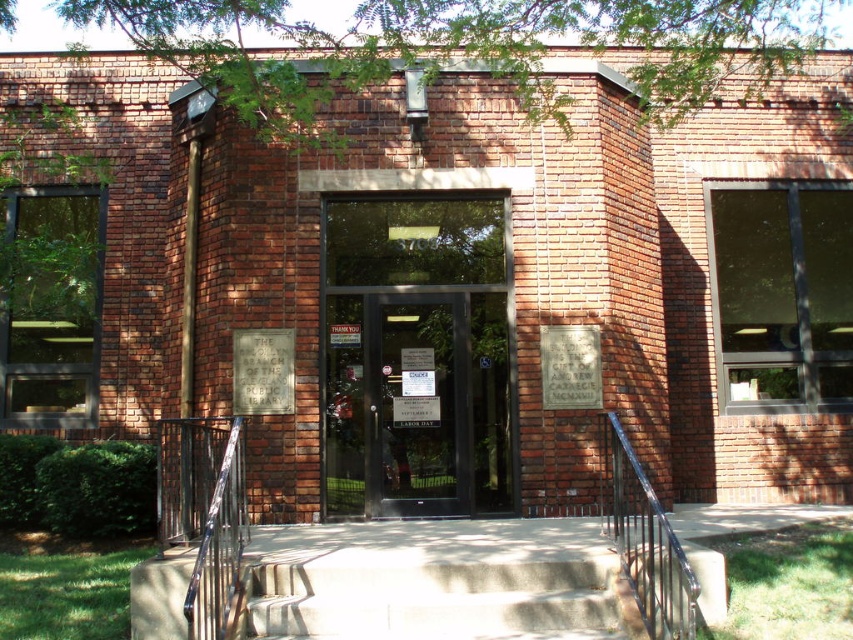
Question: Does transparent glass door at center have a larger size compared to black metal/rail at center?

Choices:
 (A) yes
 (B) no

Answer: (A)

Question: Which of the following is the farthest from the observer?

Choices:
 (A) black metal/rail at center
 (B) concrete stairs at center

Answer: (B)

Question: Observing the image, what is the correct spatial positioning of transparent glass door at center in reference to black metal/rail at center?

Choices:
 (A) below
 (B) above

Answer: (B)

Question: Can you confirm if transparent glass door at center is positioned below black metal/rail at center?

Choices:
 (A) no
 (B) yes

Answer: (A)

Question: Which object is positioned closest to the concrete stairs at center?

Choices:
 (A) transparent glass door at center
 (B) black metal/rail at center

Answer: (B)

Question: Which of the following is the closest to the observer?

Choices:
 (A) tap(469, 460)
 (B) tap(306, 627)
 (C) tap(218, 422)

Answer: (B)